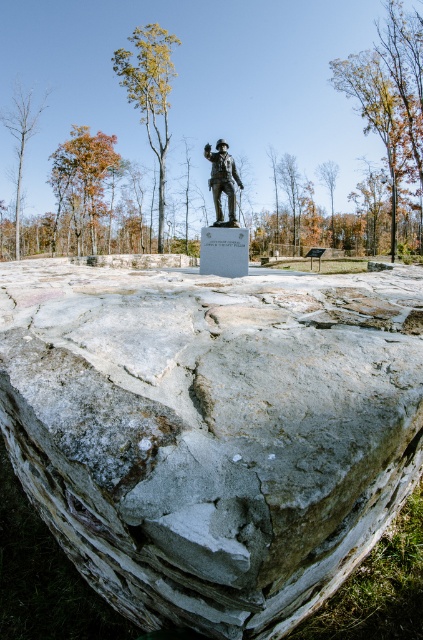
You are standing at the base of the statue and want to determine which of the two points, point [264,372] or point [13,132], is nearer to you. Based on the image, which point is closer?

Point [264,372] is closer to the viewer than point [13,132].

You are standing at the base of the statue and want to place a wreath at the point marked by coordinates point (211, 432). According to the image, what object is located at that position?

The point (211, 432) corresponds to the gray stone boulder at center, so you should place the wreath there.